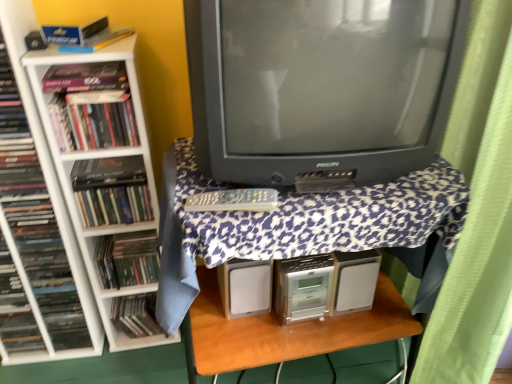
Where is `free area in between gray plastic remote at center and matte black television at center`? This screenshot has height=384, width=512. free area in between gray plastic remote at center and matte black television at center is located at coordinates (324, 202).